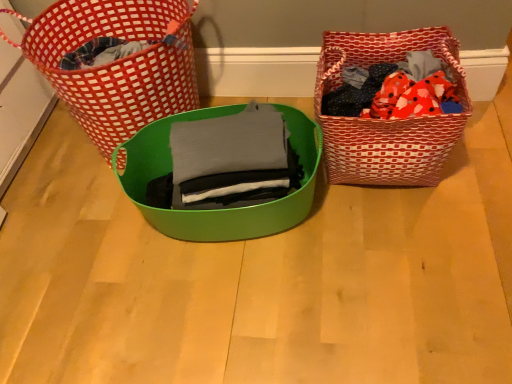
In order to click on free spot to the left of green plastic bowl at center in this screenshot , I will do `click(65, 243)`.